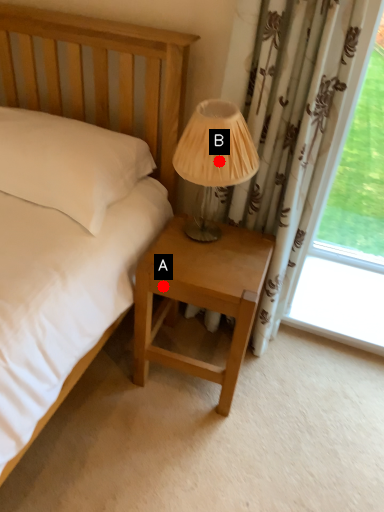
Question: Two points are circled on the image, labeled by A and B beside each circle. Among these points, which one is farthest from the camera?

Choices:
 (A) A is further
 (B) B is further

Answer: (A)